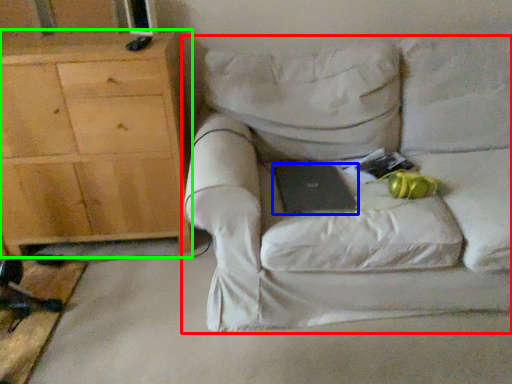
Question: Considering the real-world distances, which object is closest to chair (highlighted by a red box)? laptop (highlighted by a blue box) or cabinetry (highlighted by a green box).

Choices:
 (A) laptop
 (B) cabinetry

Answer: (A)